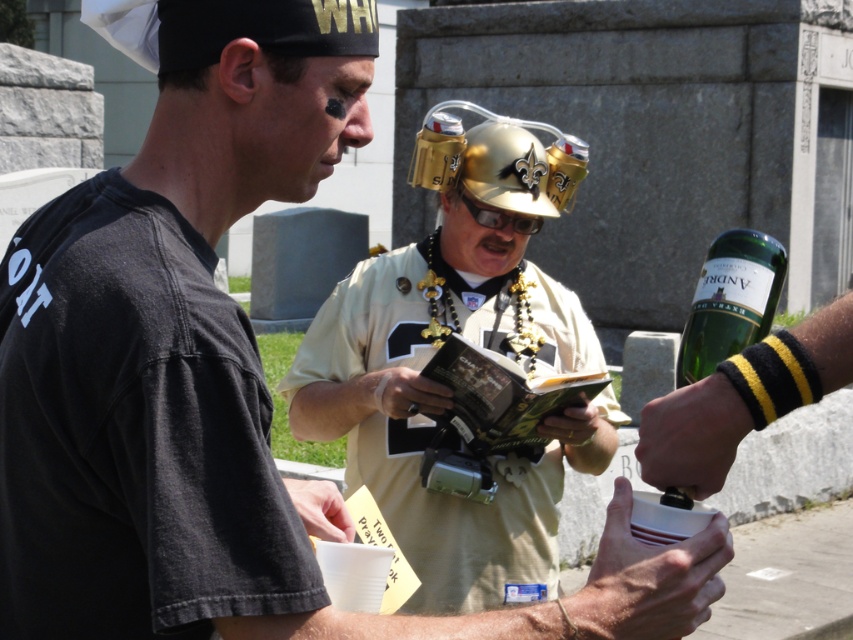
Question: Which of the following is the closest to the observer?

Choices:
 (A) gold metallic helmet at center
 (B) green glass bottle at upper right

Answer: (B)

Question: Is gold metallic helmet at center to the right of green glass bottle at upper right from the viewer's perspective?

Choices:
 (A) no
 (B) yes

Answer: (A)

Question: Can you confirm if gold metallic helmet at center is bigger than green glass bottle at upper right?

Choices:
 (A) no
 (B) yes

Answer: (B)

Question: Among these objects, which one is farthest from the camera?

Choices:
 (A) gold metallic helmet at center
 (B) green glass bottle at upper right

Answer: (A)

Question: Can you confirm if gold metallic helmet at center is smaller than green glass bottle at upper right?

Choices:
 (A) yes
 (B) no

Answer: (B)